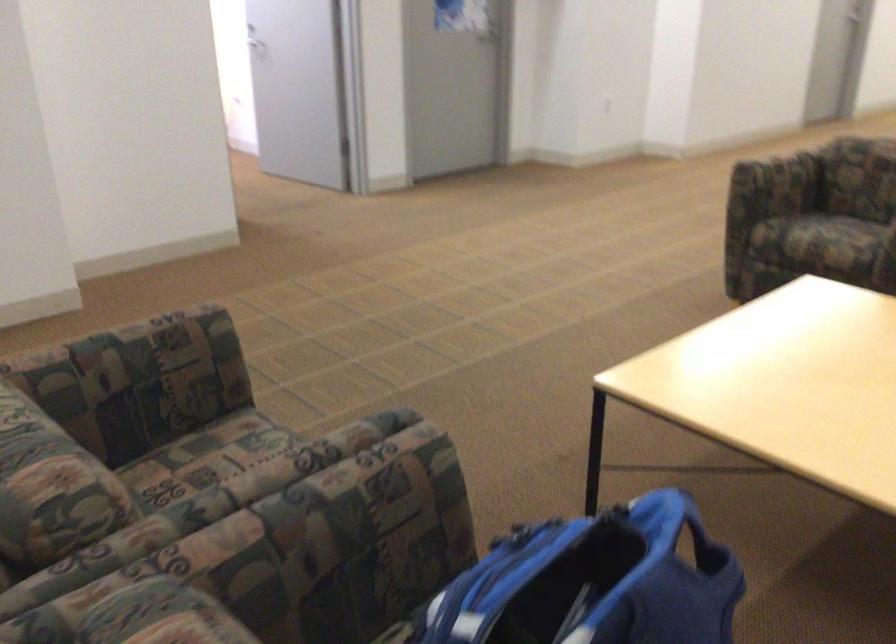
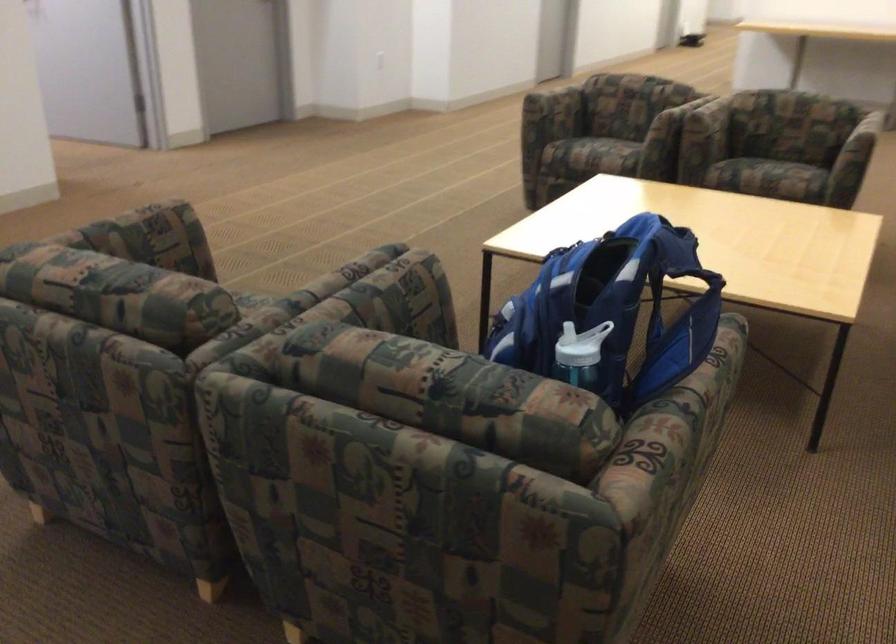
Question: The camera is either moving clockwise (left) or counter-clockwise (right) around the object. The first image is from the beginning of the video and the second image is from the end. Is the camera moving left or right when shooting the video?

Choices:
 (A) Left
 (B) Right

Answer: (A)